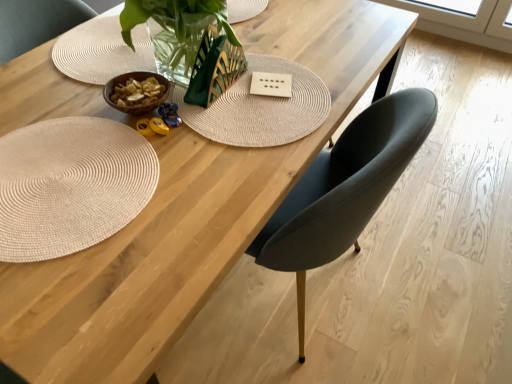
The height and width of the screenshot is (384, 512). Find the location of `free spot to the right of white matte card at center`. free spot to the right of white matte card at center is located at coordinates (324, 87).